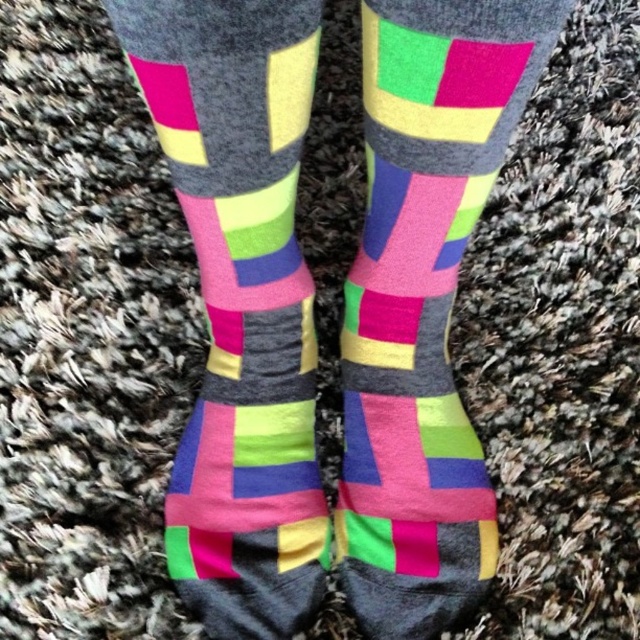
Based on the photo, between matte cotton socks at center and matte multicolored socks at center, which one appears on the left side from the viewer's perspective?

From the viewer's perspective, matte cotton socks at center appears more on the left side.

Who is positioned more to the right, matte cotton socks at center or matte multicolored socks at center?

From the viewer's perspective, matte multicolored socks at center appears more on the right side.

Does point (266, 252) come closer to viewer compared to point (429, 596)?

No, (266, 252) is further to viewer.

Where is `matte cotton socks at center`? The width and height of the screenshot is (640, 640). matte cotton socks at center is located at coordinates (241, 304).